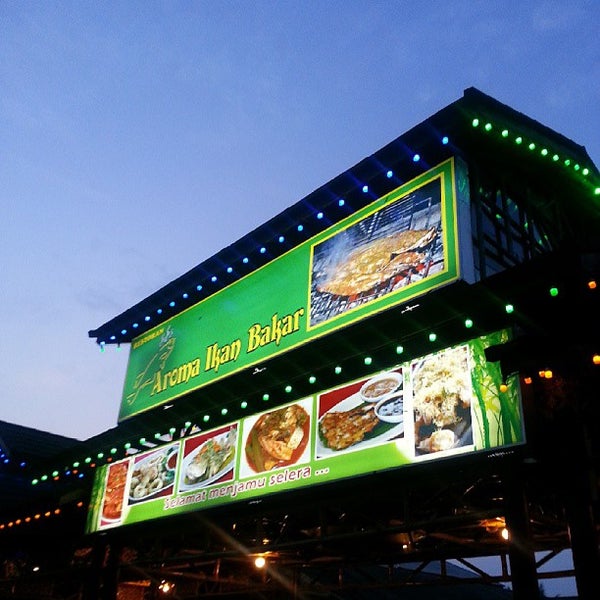
This screenshot has height=600, width=600. Identify the location of bowl. (389, 414), (380, 383).